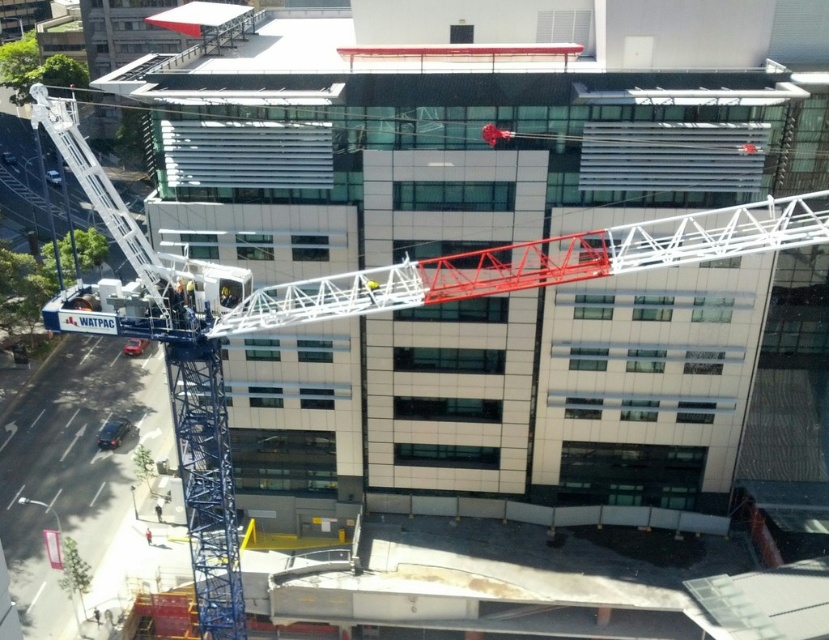
You are a construction worker who needs to access the roof of the building in the image. You see a white metallic ladder at left. Based on its coordinates, can you determine if the ladder is positioned near the building or away from it?

The white metallic ladder at left is positioned at coordinates point (102, 195). Since the coordinates are closer to the edges of the image frame, the ladder is likely positioned near the building.